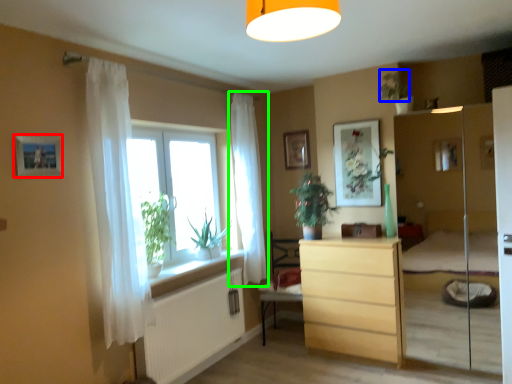
Question: Estimate the real-world distances between objects in this image. Which object is closer to picture frame (highlighted by a red box), plant (highlighted by a blue box) or curtain (highlighted by a green box)?

Choices:
 (A) plant
 (B) curtain

Answer: (B)